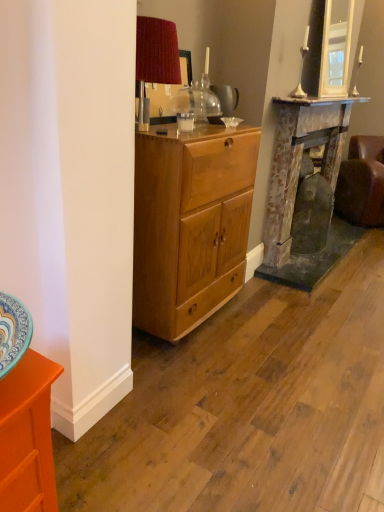
Question: Does brown leather couch at right have a greater height compared to rusty metal fireplace at right?

Choices:
 (A) no
 (B) yes

Answer: (A)

Question: Are brown leather couch at right and rusty metal fireplace at right far apart?

Choices:
 (A) yes
 (B) no

Answer: (B)

Question: Would you say rusty metal fireplace at right is part of brown leather couch at right's contents?

Choices:
 (A) no
 (B) yes

Answer: (A)

Question: Is brown leather couch at right oriented away from rusty metal fireplace at right?

Choices:
 (A) yes
 (B) no

Answer: (B)

Question: From a real-world perspective, is brown leather couch at right physically above rusty metal fireplace at right?

Choices:
 (A) yes
 (B) no

Answer: (B)

Question: Considering the relative sizes of brown leather couch at right and rusty metal fireplace at right in the image provided, is brown leather couch at right thinner than rusty metal fireplace at right?

Choices:
 (A) yes
 (B) no

Answer: (B)

Question: Is brown leather couch at right taller than orange glossy cabinet at lower left?

Choices:
 (A) yes
 (B) no

Answer: (A)

Question: From a real-world perspective, is brown leather couch at right on top of orange glossy cabinet at lower left?

Choices:
 (A) yes
 (B) no

Answer: (A)

Question: Is the depth of brown leather couch at right less than that of orange glossy cabinet at lower left?

Choices:
 (A) no
 (B) yes

Answer: (A)

Question: From the image's perspective, is brown leather couch at right located beneath orange glossy cabinet at lower left?

Choices:
 (A) no
 (B) yes

Answer: (A)

Question: Could you tell me if brown leather couch at right is facing orange glossy cabinet at lower left?

Choices:
 (A) no
 (B) yes

Answer: (A)

Question: Does brown leather couch at right touch orange glossy cabinet at lower left?

Choices:
 (A) no
 (B) yes

Answer: (A)

Question: Is orange glossy cabinet at lower left further to camera compared to clear glass coffee cup at center?

Choices:
 (A) no
 (B) yes

Answer: (A)